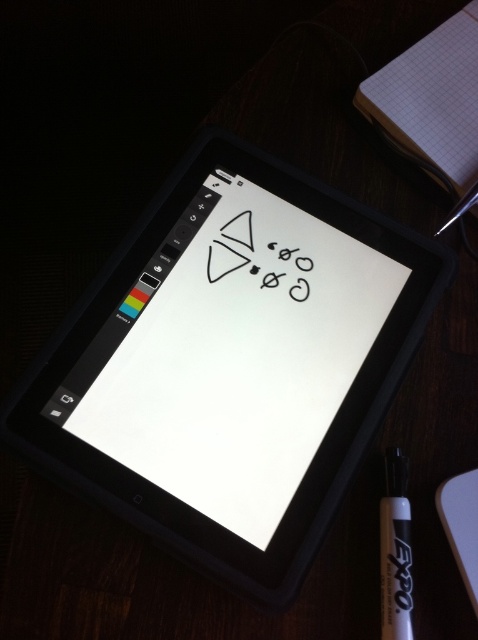
Can you confirm if black plastic tablet at center is wider than black marker pen at bottom right?

Yes, black plastic tablet at center is wider than black marker pen at bottom right.

Describe the element at coordinates (231, 364) in the screenshot. I see `black plastic tablet at center` at that location.

Who is more distant from viewer, (221, 189) or (391, 493)?

The point (221, 189) is behind.

At what (x,y) coordinates should I click in order to perform the action: click on black plastic tablet at center. Please return your answer as a coordinate pair (x, y). Image resolution: width=478 pixels, height=640 pixels. Looking at the image, I should click on tap(231, 364).

Can you confirm if black plastic tablet at center is shorter than white grid paper at upper right?

No.

Can you confirm if black plastic tablet at center is bigger than white grid paper at upper right?

Correct, black plastic tablet at center is larger in size than white grid paper at upper right.

Which is in front, point (284, 380) or point (468, 56)?

Point (284, 380) is more forward.

Find the location of a particular element. This screenshot has height=640, width=478. black plastic tablet at center is located at coordinates (231, 364).

Is white grid paper at upper right to the right of black marker pen at bottom right from the viewer's perspective?

Yes, white grid paper at upper right is to the right of black marker pen at bottom right.

Between white grid paper at upper right and black marker pen at bottom right, which one is positioned higher?

white grid paper at upper right is above.

Between point (456, 189) and point (403, 468), which one is positioned behind?

The point (456, 189) is behind.

The image size is (478, 640). I want to click on white grid paper at upper right, so click(432, 97).